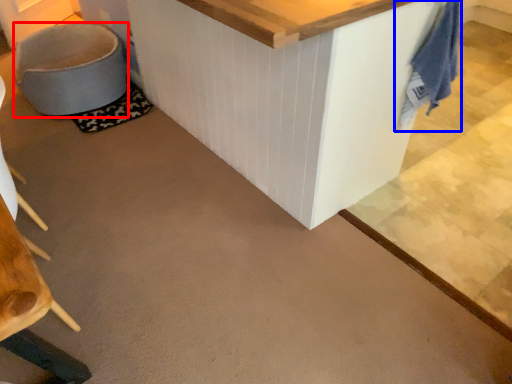
Question: Which of the following is the farthest to the observer, swivel chair (highlighted by a red box) or laundry (highlighted by a blue box)?

Choices:
 (A) swivel chair
 (B) laundry

Answer: (A)